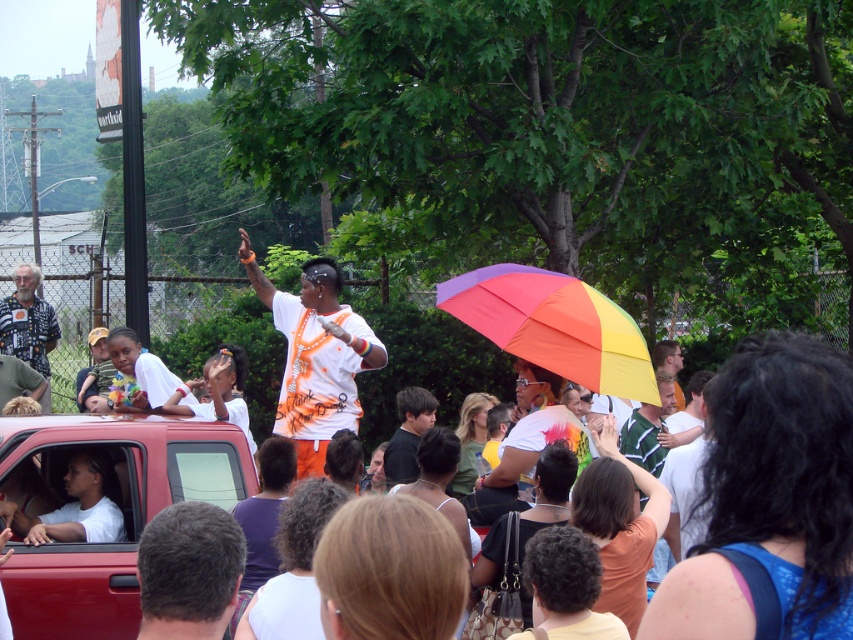
Question: Does matte red truck at lower left have a lesser width compared to white matte shirt at center?

Choices:
 (A) yes
 (B) no

Answer: (B)

Question: Can you confirm if white matte shirt at center is smaller than dark brown hair at lower left?

Choices:
 (A) no
 (B) yes

Answer: (A)

Question: Is rainbow fabric umbrella at center above dark brown hair at lower left?

Choices:
 (A) yes
 (B) no

Answer: (A)

Question: Which point is closer to the camera taking this photo?

Choices:
 (A) (38, 339)
 (B) (26, 477)

Answer: (B)

Question: Which point is farther to the camera?

Choices:
 (A) dark brown hair at lower left
 (B) rainbow fabric umbrella at center
 (C) white matte shirt at center

Answer: (C)

Question: Which point is closer to the camera?

Choices:
 (A) white matte shirt at center
 (B) rainbow fabric umbrella at center

Answer: (B)